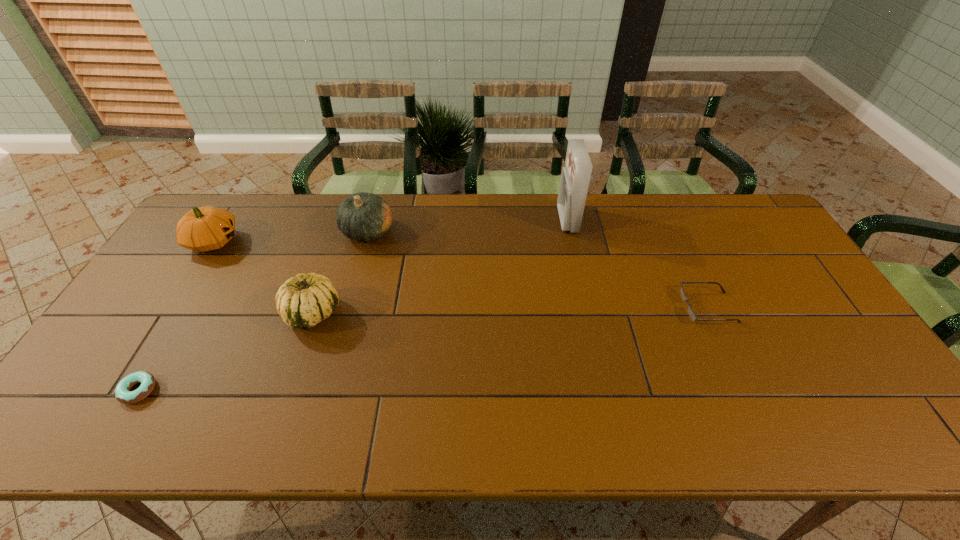
The height and width of the screenshot is (540, 960). In order to click on the first-aid kit in this screenshot , I will do `click(575, 177)`.

Where is `the tallest object`? This screenshot has width=960, height=540. the tallest object is located at coordinates (575, 177).

Locate an element on the screen. the leftmost gourd is located at coordinates coord(202,229).

Where is `the nearest gourd`? The height and width of the screenshot is (540, 960). the nearest gourd is located at coordinates 302,301.

The width and height of the screenshot is (960, 540). I want to click on the second shortest object, so click(x=684, y=298).

Find the location of a particular element. spectacles is located at coordinates (684, 298).

The width and height of the screenshot is (960, 540). What are the coordinates of `the shortest object` in the screenshot? It's located at (122, 394).

Where is `doughnut`? doughnut is located at coordinates pos(122,394).

Identify the location of vacant space located 0.340m on the front-facing side of the first-aid kit. (459, 220).

Find the location of a particular element. The image size is (960, 540). vacant region located 0.090m on the front-facing side of the first-aid kit is located at coordinates (533, 220).